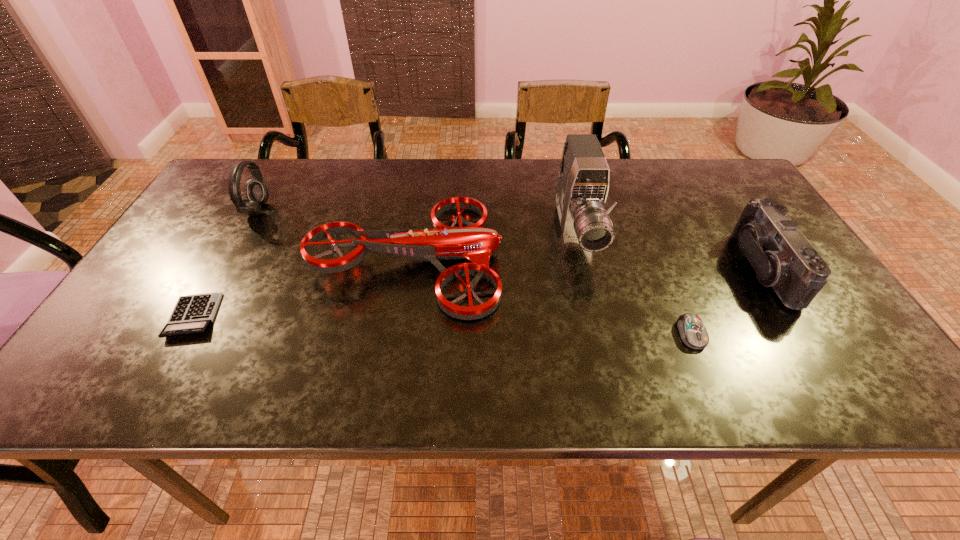
Where is `free spot between the tallest object and the calculator`? Image resolution: width=960 pixels, height=540 pixels. free spot between the tallest object and the calculator is located at coordinates (385, 274).

At what (x,y) coordinates should I click in order to perform the action: click on vacant space in between the rightmost object and the third object from right to left. Please return your answer as a coordinate pair (x, y). The height and width of the screenshot is (540, 960). Looking at the image, I should click on (669, 251).

This screenshot has width=960, height=540. What are the coordinates of `blank region between the headset and the taller camcorder` in the screenshot? It's located at (417, 221).

You are a GUI agent. You are given a task and a screenshot of the screen. Output one action in this format:
    pyautogui.click(x=<x>, y=<y>)
    Task: Click on the vacant space that's between the rightmost object and the third object from right to left
    
    Given the screenshot: What is the action you would take?
    pyautogui.click(x=669, y=251)

I want to click on vacant space that's between the second object from right to left and the left camcorder, so click(x=634, y=284).

At what (x,y) coordinates should I click in order to perform the action: click on free space between the drone and the right camcorder. Please return your answer as a coordinate pair (x, y). This screenshot has height=540, width=960. Looking at the image, I should click on (585, 262).

Where is `the third closest object to the right camcorder`? the third closest object to the right camcorder is located at coordinates (475, 242).

This screenshot has width=960, height=540. What are the coordinates of `the second closest object to the second object from right to left` in the screenshot? It's located at (583, 177).

Identify the location of vacant area in the image that satisfies the following two spatial constraints: 1. on the earcups of the drone; 2. on the right side of the headset. (230, 256).